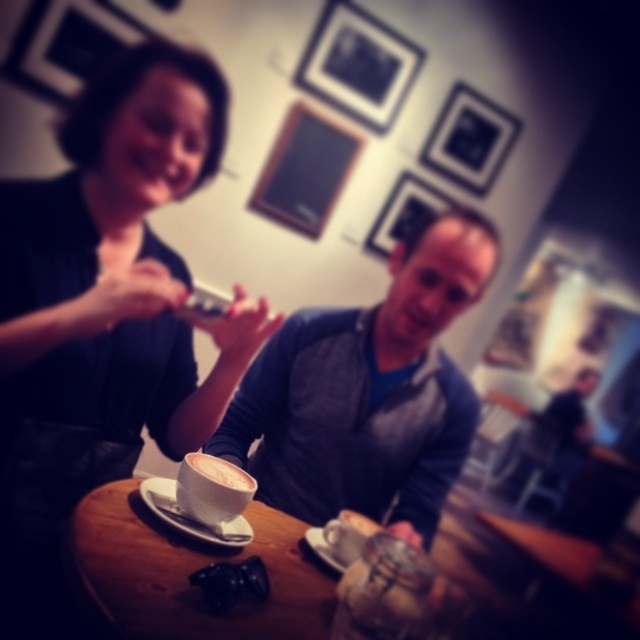
Question: Is wooden table at center to the right of white matte saucer at center from the viewer's perspective?

Choices:
 (A) no
 (B) yes

Answer: (B)

Question: Which of the following is the farthest from the observer?

Choices:
 (A) (205, 538)
 (B) (141, 225)

Answer: (B)

Question: Is wooden table at center above white matte saucer at center?

Choices:
 (A) yes
 (B) no

Answer: (B)

Question: Can you confirm if wooden table at center is positioned to the left of white matte saucer at center?

Choices:
 (A) no
 (B) yes

Answer: (A)

Question: Which of the following is the farthest from the observer?

Choices:
 (A) (170, 481)
 (B) (230, 472)
 (C) (413, 234)

Answer: (C)

Question: Which of these objects is positioned closest to the white matte saucer at center?

Choices:
 (A) white frothy coffee at center
 (B) matte white cup at center

Answer: (B)